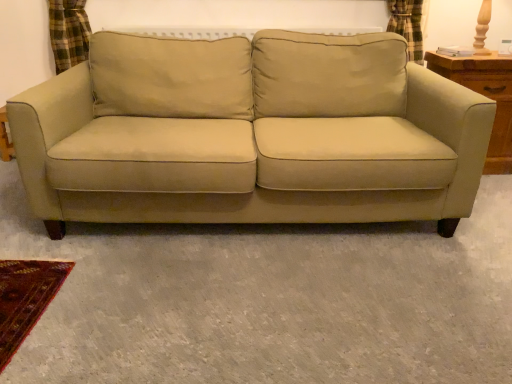
Locate an element on the screen. vacant space in front of suede-like beige couch at center is located at coordinates (251, 300).